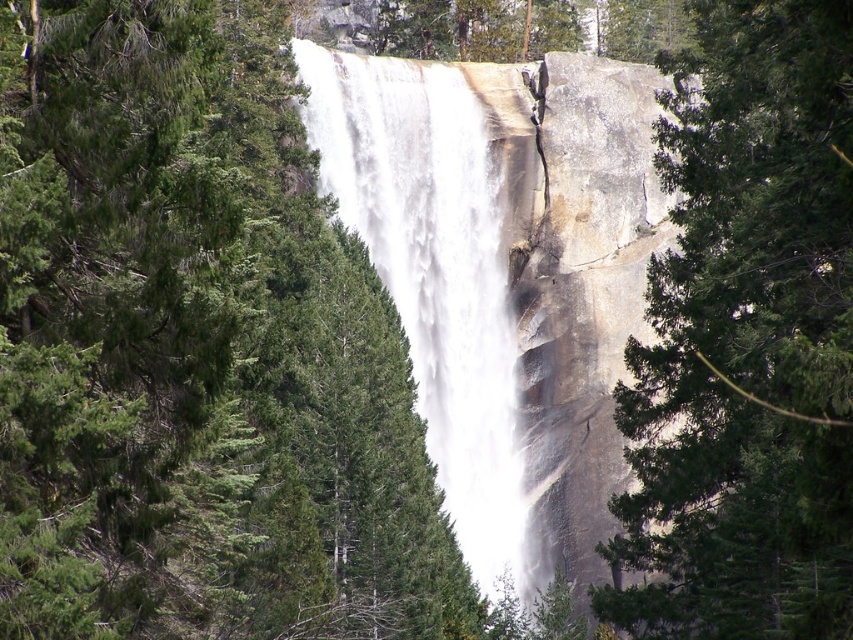
Is green textured tree at center closer to camera compared to white frothy water at center?

That is True.

Between green textured tree at center and white frothy water at center, which one appears on the right side from the viewer's perspective?

green textured tree at center is more to the right.

Between point (776, 180) and point (515, 515), which one is positioned in front?

Point (776, 180)

You are a GUI agent. You are given a task and a screenshot of the screen. Output one action in this format:
    pyautogui.click(x=<x>, y=<y>)
    Task: Click on the green textured tree at center
    This screenshot has height=640, width=853.
    Given the screenshot: What is the action you would take?
    pyautogui.click(x=746, y=339)